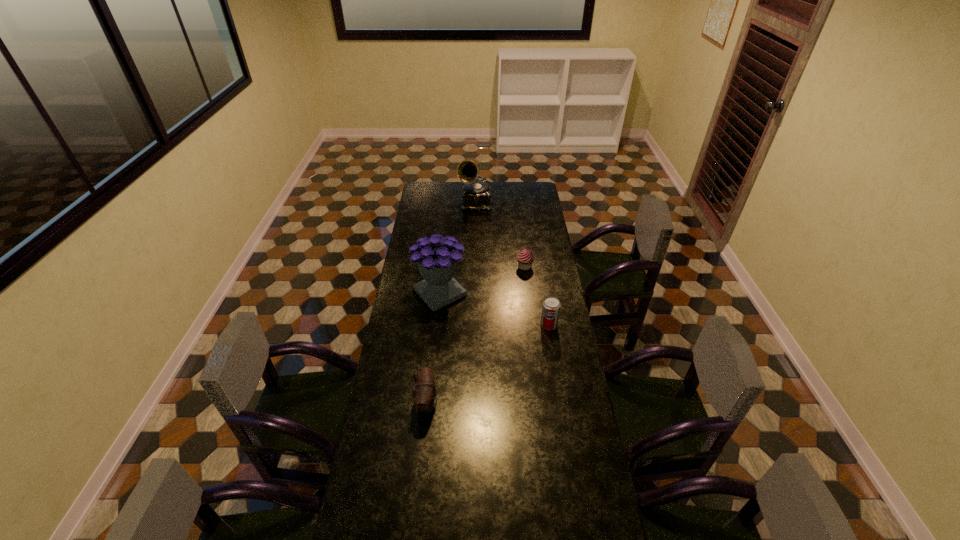
You are a GUI agent. You are given a task and a screenshot of the screen. Output one action in this format:
    pyautogui.click(x=<x>, y=<y>)
    Task: Click on the vacant position located 0.190m on the left of the shortest object
    This screenshot has width=960, height=540.
    Given the screenshot: What is the action you would take?
    pyautogui.click(x=479, y=266)

You are a GUI agent. You are given a task and a screenshot of the screen. Output one action in this format:
    pyautogui.click(x=<x>, y=<y>)
    Task: Click on the object that is at the far edge
    Image resolution: width=960 pixels, height=540 pixels.
    Given the screenshot: What is the action you would take?
    pyautogui.click(x=476, y=195)

Identify the location of bouquet that is positioned at the left edge. (437, 259).

This screenshot has height=540, width=960. I want to click on pouch that is positioned at the left edge, so click(424, 395).

Locate an element on the screen. The width and height of the screenshot is (960, 540). soda at the right edge is located at coordinates (551, 306).

Where is `cupcake that is positioned at the right edge`? cupcake that is positioned at the right edge is located at coordinates (525, 258).

Identify the location of vacant space at the far edge. The image size is (960, 540). (461, 184).

This screenshot has height=540, width=960. Find the location of `vacant space at the left edge`. vacant space at the left edge is located at coordinates (373, 441).

Where is `vacant area at the right edge`? vacant area at the right edge is located at coordinates (568, 516).

At what (x,y) coordinates should I click in order to perform the action: click on free space at the far right corner. Please return your answer as a coordinate pair (x, y). This screenshot has width=960, height=540. Looking at the image, I should click on (541, 201).